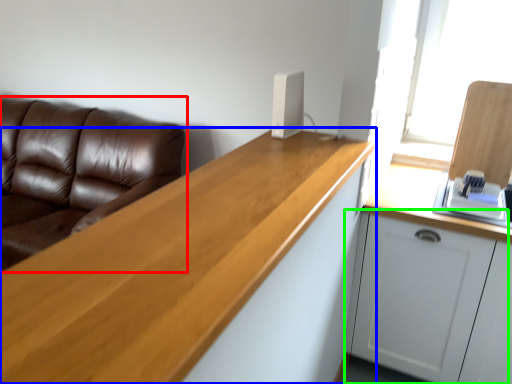
Question: Based on their relative distances, which object is farther from studio couch (highlighted by a red box)? Choose from countertop (highlighted by a blue box) and cabinetry (highlighted by a green box).

Choices:
 (A) countertop
 (B) cabinetry

Answer: (B)